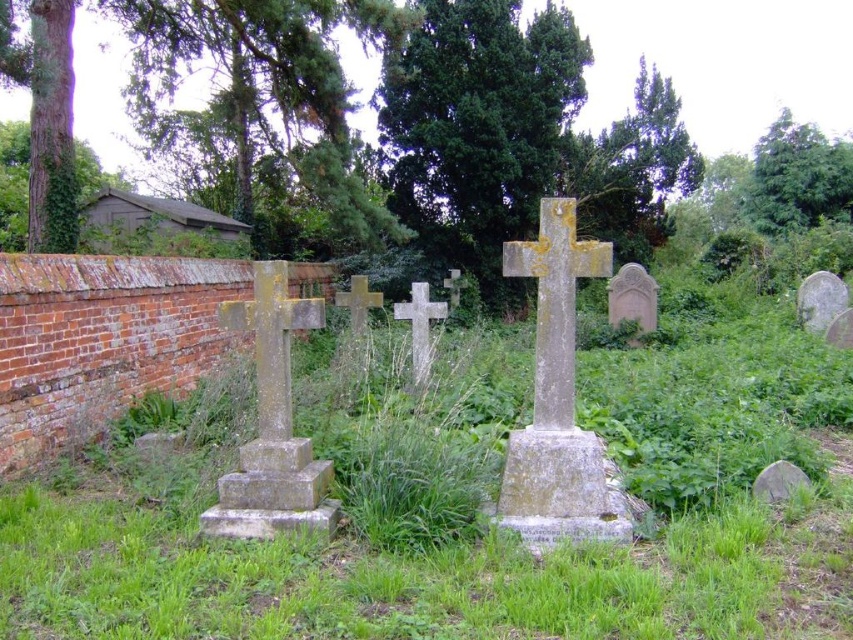
You are standing at the origin point in the image. Which direction should you move to reach the green grass at center?

The green grass at center is located at point 0.789 on the x axis and 0.538 on the y axis. Since you are at the origin, you should move towards the positive x and y directions to reach it.

You are standing at the edge of a cemetery and notice the green grass at center and the stone cross at center. Which object is nearer to you?

The green grass at center is closer to the viewer than the stone cross at center, so the green grass at center is nearer.